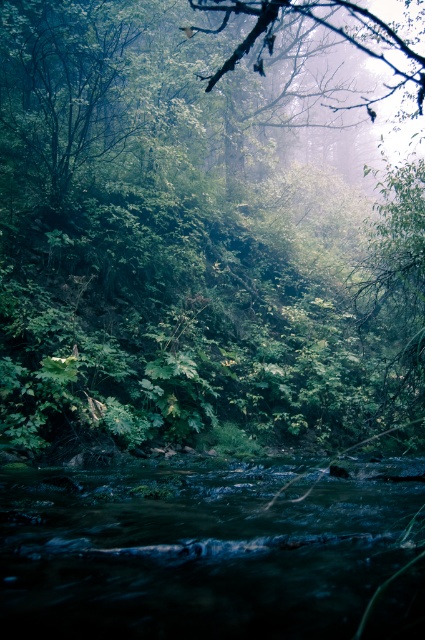
Can you confirm if green leafy tree at center is positioned above dark green water at center?

Yes.

Is point (56, 13) positioned after point (8, 518)?

Yes, it is.

Find the location of a particular element. The image size is (425, 640). green leafy tree at center is located at coordinates (172, 250).